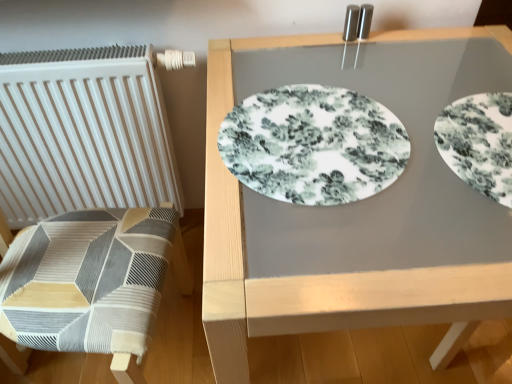
Locate an element on the screen. free space behind white floral plate at center, the 1th plate in the left-to-right sequence is located at coordinates (295, 61).